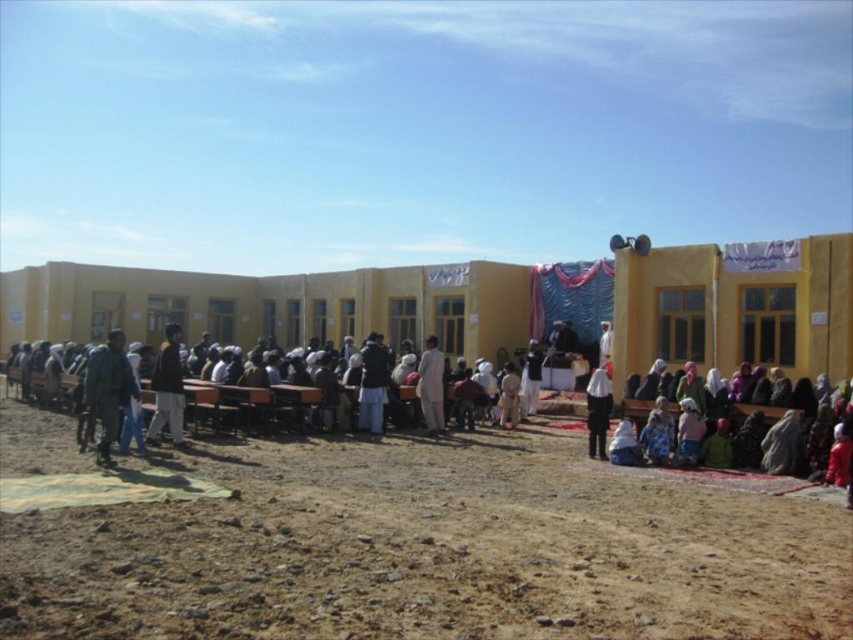
Question: Considering the real-world distances, which object is farthest from the brown sandy ground at lower center?

Choices:
 (A) dark blue fabric at center
 (B) dark brown leather jacket at left
 (C) light beige fabric at center

Answer: (A)

Question: Is brown sandy ground at lower center thinner than dark blue fabric at center?

Choices:
 (A) yes
 (B) no

Answer: (B)

Question: Estimate the real-world distances between objects in this image. Which object is farther from the dark brown leather jacket at left?

Choices:
 (A) dark blue fabric at center
 (B) white fabric at center
 (C) brown sandy ground at lower center
 (D) dark blue jeans at left

Answer: (A)

Question: Can you confirm if light beige fabric at center is wider than white fabric at center?

Choices:
 (A) no
 (B) yes

Answer: (B)

Question: Can you confirm if light beige fabric at center is positioned to the right of white fabric at center?

Choices:
 (A) yes
 (B) no

Answer: (B)

Question: Which of the following is the closest to the observer?

Choices:
 (A) light brown wooden benches at center
 (B) dark blue jeans at left

Answer: (A)